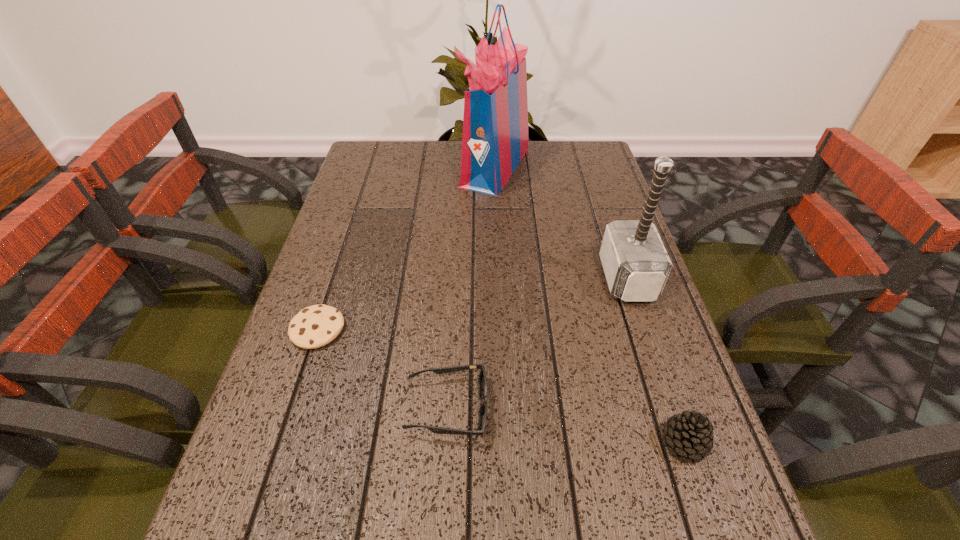
This screenshot has width=960, height=540. I want to click on free space between the pinecone and the cookie, so click(x=501, y=386).

Identify the location of vacant point located between the third shortest object and the sunglasses. (565, 425).

This screenshot has width=960, height=540. In order to click on empty space between the third farthest object and the fourth nearest object in this screenshot , I will do `click(472, 303)`.

You are a GUI agent. You are given a task and a screenshot of the screen. Output one action in this format:
    pyautogui.click(x=<x>, y=<y>)
    Task: Click on the free area in between the pinecone and the hammer
    
    Given the screenshot: What is the action you would take?
    tap(656, 360)

Where is `vacant area that lies between the pinecone and the cookie`? vacant area that lies between the pinecone and the cookie is located at coordinates (501, 386).

Locate an element on the screen. This screenshot has width=960, height=540. empty space between the third farthest object and the sunglasses is located at coordinates click(382, 368).

What are the coordinates of `vacant space that's between the sunglasses and the tallest object` in the screenshot? It's located at (471, 287).

Where is `free space between the pinecone and the third nearest object`? The image size is (960, 540). free space between the pinecone and the third nearest object is located at coordinates (501, 386).

At what (x,y) coordinates should I click in order to perform the action: click on object that is the nearest to the tallest object. Please return your answer as a coordinate pair (x, y). This screenshot has width=960, height=540. Looking at the image, I should click on click(x=636, y=264).

Locate an element on the screen. The height and width of the screenshot is (540, 960). object that can be found as the fourth closest to the cookie is located at coordinates (690, 435).